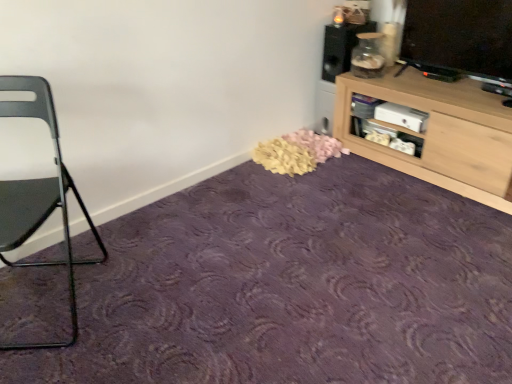
Question: Is metallic gray chair at left turned away from purple carpet at center?

Choices:
 (A) yes
 (B) no

Answer: (B)

Question: Could you tell me if metallic gray chair at left is turned towards purple carpet at center?

Choices:
 (A) yes
 (B) no

Answer: (B)

Question: From a real-world perspective, is metallic gray chair at left over purple carpet at center?

Choices:
 (A) yes
 (B) no

Answer: (A)

Question: Is metallic gray chair at left completely or partially outside of purple carpet at center?

Choices:
 (A) no
 (B) yes

Answer: (B)

Question: Does metallic gray chair at left have a larger size compared to purple carpet at center?

Choices:
 (A) yes
 (B) no

Answer: (A)

Question: Relative to matte black speaker at upper right, is metallic gray chair at left in front or behind?

Choices:
 (A) front
 (B) behind

Answer: (A)

Question: Considering the positions of metallic gray chair at left and matte black speaker at upper right in the image, is metallic gray chair at left wider or thinner than matte black speaker at upper right?

Choices:
 (A) thin
 (B) wide

Answer: (B)

Question: Is metallic gray chair at left spatially inside matte black speaker at upper right, or outside of it?

Choices:
 (A) outside
 (B) inside

Answer: (A)

Question: From a real-world perspective, relative to matte black speaker at upper right, is metallic gray chair at left vertically above or below?

Choices:
 (A) above
 (B) below

Answer: (B)

Question: Looking at the image, does matte black speaker at upper right seem bigger or smaller compared to light wood cabinet at upper right?

Choices:
 (A) big
 (B) small

Answer: (B)

Question: From a real-world perspective, is matte black speaker at upper right physically located above or below light wood cabinet at upper right?

Choices:
 (A) below
 (B) above

Answer: (B)

Question: Visually, is matte black speaker at upper right positioned to the left or to the right of light wood cabinet at upper right?

Choices:
 (A) right
 (B) left

Answer: (B)

Question: In the image, is matte black speaker at upper right positioned in front of or behind light wood cabinet at upper right?

Choices:
 (A) behind
 (B) front

Answer: (A)

Question: From a real-world perspective, is matte black speaker at upper right above or below metallic gray chair at left?

Choices:
 (A) below
 (B) above

Answer: (B)

Question: Considering the positions of matte black speaker at upper right and metallic gray chair at left in the image, is matte black speaker at upper right wider or thinner than metallic gray chair at left?

Choices:
 (A) thin
 (B) wide

Answer: (A)